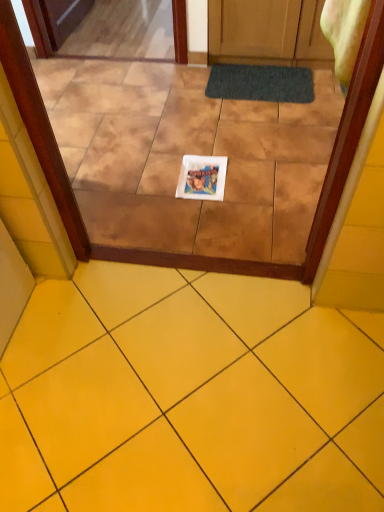
Question: Is yellow ceramic tile at lower center at the left side of transparent glass door at center?

Choices:
 (A) yes
 (B) no

Answer: (B)

Question: Is yellow ceramic tile at lower center far from transparent glass door at center?

Choices:
 (A) no
 (B) yes

Answer: (A)

Question: Is yellow ceramic tile at lower center touching transparent glass door at center?

Choices:
 (A) yes
 (B) no

Answer: (B)

Question: Can you confirm if yellow ceramic tile at lower center is wider than transparent glass door at center?

Choices:
 (A) no
 (B) yes

Answer: (A)

Question: Can you confirm if yellow ceramic tile at lower center is thinner than transparent glass door at center?

Choices:
 (A) yes
 (B) no

Answer: (A)

Question: Considering the relative positions of yellow ceramic tile at lower center and transparent glass door at center in the image provided, is yellow ceramic tile at lower center to the right of transparent glass door at center from the viewer's perspective?

Choices:
 (A) yes
 (B) no

Answer: (A)

Question: Is white paper at center positioned far away from dark gray textured bath mat at center?

Choices:
 (A) yes
 (B) no

Answer: (B)

Question: Is white paper at center beside dark gray textured bath mat at center?

Choices:
 (A) no
 (B) yes

Answer: (A)

Question: Does white paper at center appear on the left side of dark gray textured bath mat at center?

Choices:
 (A) no
 (B) yes

Answer: (B)

Question: Is white paper at center taller than dark gray textured bath mat at center?

Choices:
 (A) no
 (B) yes

Answer: (A)

Question: From the image's perspective, is white paper at center beneath dark gray textured bath mat at center?

Choices:
 (A) no
 (B) yes

Answer: (B)

Question: From a real-world perspective, is white paper at center physically above dark gray textured bath mat at center?

Choices:
 (A) no
 (B) yes

Answer: (A)

Question: Is white paper at center taller than transparent glass door at center?

Choices:
 (A) yes
 (B) no

Answer: (B)